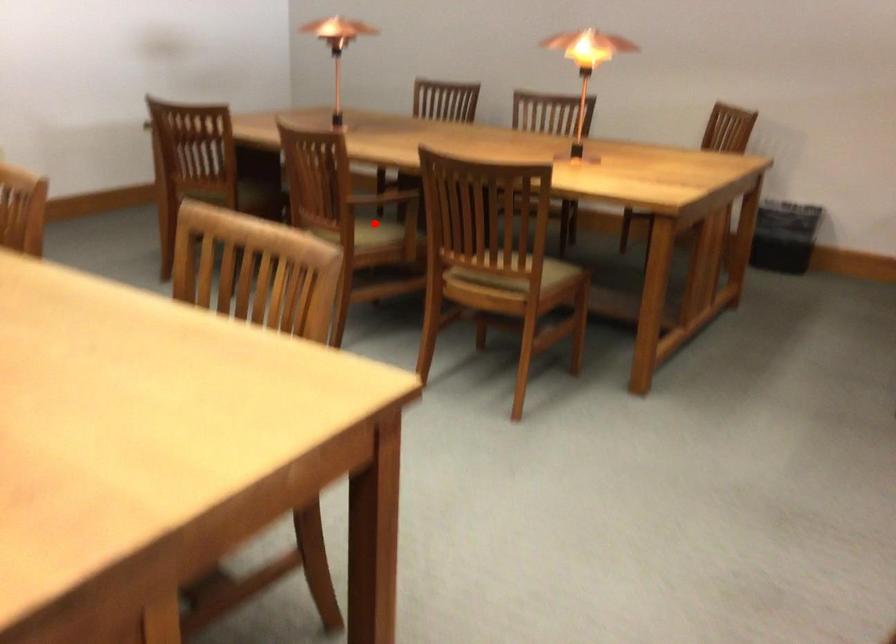
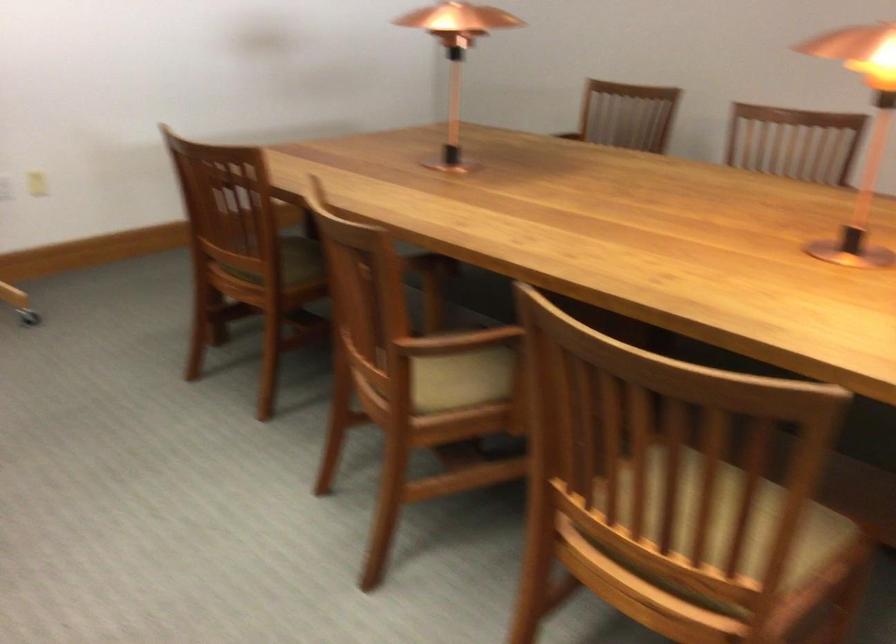
The point at the highlighted location is marked in the first image. Where is the corresponding point in the second image?

(460, 377)